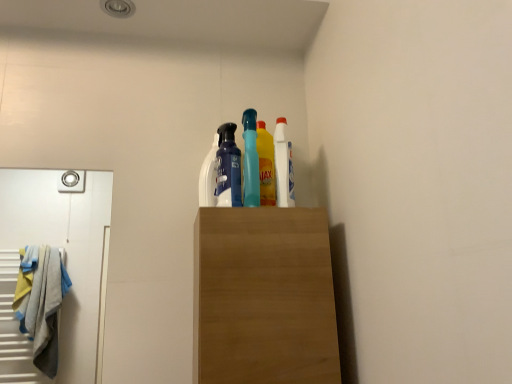
Question: From the image's perspective, does matte blue spray bottle at center appear lower than white glossy bottle at upper center, which is the 1th cleaning product from left to right?

Choices:
 (A) yes
 (B) no

Answer: (B)

Question: Is matte blue spray bottle at center not inside white glossy bottle at upper center, which is the 1th cleaning product from left to right?

Choices:
 (A) no
 (B) yes

Answer: (B)

Question: Is matte blue spray bottle at center thinner than white glossy bottle at upper center, which is the 1th cleaning product from left to right?

Choices:
 (A) no
 (B) yes

Answer: (A)

Question: Does matte blue spray bottle at center touch white glossy bottle at upper center, which is the 1th cleaning product from left to right?

Choices:
 (A) yes
 (B) no

Answer: (A)

Question: Does matte blue spray bottle at center appear on the right side of white glossy bottle at upper center, the 2th cleaning product viewed from the right?

Choices:
 (A) yes
 (B) no

Answer: (A)

Question: From a real-world perspective, is white plastic bottle at upper center, marked as the 1th cleaning product in a right-to-left arrangement, positioned above or below white glossy bottle at upper center, the 2th cleaning product viewed from the right?

Choices:
 (A) below
 (B) above

Answer: (A)

Question: Choose the correct answer: Is white plastic bottle at upper center, marked as the 1th cleaning product in a right-to-left arrangement, inside white glossy bottle at upper center, which is the 1th cleaning product from left to right, or outside it?

Choices:
 (A) outside
 (B) inside

Answer: (A)

Question: From their relative heights in the image, would you say white plastic bottle at upper center, marked as the 1th cleaning product in a right-to-left arrangement, is taller or shorter than white glossy bottle at upper center, the 2th cleaning product viewed from the right?

Choices:
 (A) short
 (B) tall

Answer: (B)

Question: Is point (289, 188) positioned closer to the camera than point (211, 190)?

Choices:
 (A) closer
 (B) farther

Answer: (A)

Question: Does point (220, 148) appear closer or farther from the camera than point (281, 182)?

Choices:
 (A) closer
 (B) farther

Answer: (B)

Question: From the image's perspective, is matte blue spray bottle at center positioned above or below white plastic bottle at upper center, which ranks as the 2th cleaning product in left-to-right order?

Choices:
 (A) below
 (B) above

Answer: (B)

Question: From a real-world perspective, is matte blue spray bottle at center positioned above or below white plastic bottle at upper center, which ranks as the 2th cleaning product in left-to-right order?

Choices:
 (A) above
 (B) below

Answer: (A)

Question: Which is correct: matte blue spray bottle at center is inside white plastic bottle at upper center, marked as the 1th cleaning product in a right-to-left arrangement, or outside of it?

Choices:
 (A) inside
 (B) outside

Answer: (B)

Question: Relative to white plastic bottle at upper center, marked as the 1th cleaning product in a right-to-left arrangement, is white glossy bottle at upper center, which is the 1th cleaning product from left to right, in front or behind?

Choices:
 (A) behind
 (B) front

Answer: (A)

Question: From their relative heights in the image, would you say white glossy bottle at upper center, which is the 1th cleaning product from left to right, is taller or shorter than white plastic bottle at upper center, which ranks as the 2th cleaning product in left-to-right order?

Choices:
 (A) short
 (B) tall

Answer: (A)